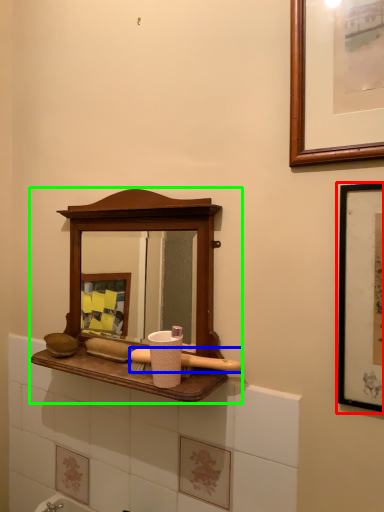
Question: Estimate the real-world distances between objects in this image. Which object is farther from picture frame (highlighted by a red box), brush (highlighted by a blue box) or medicine cabinet (highlighted by a green box)?

Choices:
 (A) brush
 (B) medicine cabinet

Answer: (B)